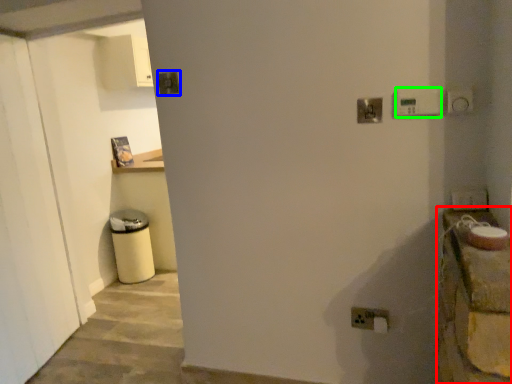
Question: Estimate the real-world distances between objects in this image. Which object is closer to counter top (highlighted by a red box), light switch (highlighted by a blue box) or light switch (highlighted by a green box)?

Choices:
 (A) light switch
 (B) light switch

Answer: (B)